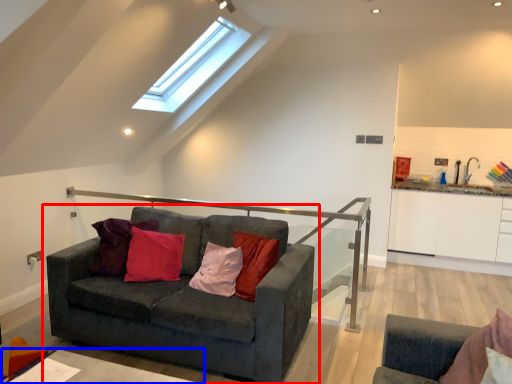
Question: Which object is further to the camera taking this photo, studio couch (highlighted by a red box) or table (highlighted by a blue box)?

Choices:
 (A) studio couch
 (B) table

Answer: (A)